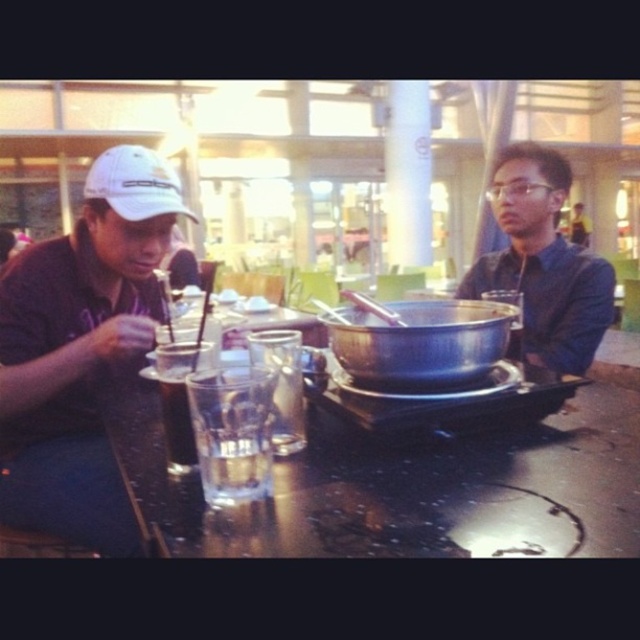
Question: Which object appears farthest from the camera in this image?

Choices:
 (A) matte white cap at left
 (B) metallic silver pot at center
 (C) matte blue shirt at right
 (D) clear glass at center

Answer: (C)

Question: Is metallic silver pot at center below clear glass at center?

Choices:
 (A) yes
 (B) no

Answer: (B)

Question: Is matte white cap at left positioned at the back of clear glass at center?

Choices:
 (A) no
 (B) yes

Answer: (B)

Question: Is matte white cap at left wider than dark brown carbonated drink at center?

Choices:
 (A) no
 (B) yes

Answer: (B)

Question: Which of the following is the farthest from the observer?

Choices:
 (A) matte white cap at left
 (B) clear glass at center

Answer: (A)

Question: Which of the following is the farthest from the observer?

Choices:
 (A) (204, 403)
 (B) (184, 442)
 (C) (396, 387)

Answer: (C)